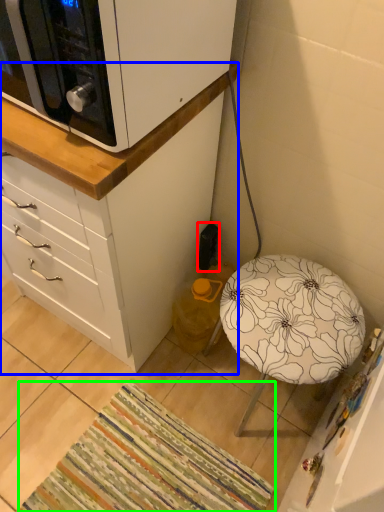
Question: Estimate the real-world distances between objects in this image. Which object is closer to electric outlet (highlighted by a red box), chest of drawers (highlighted by a blue box) or mat (highlighted by a green box)?

Choices:
 (A) chest of drawers
 (B) mat

Answer: (A)